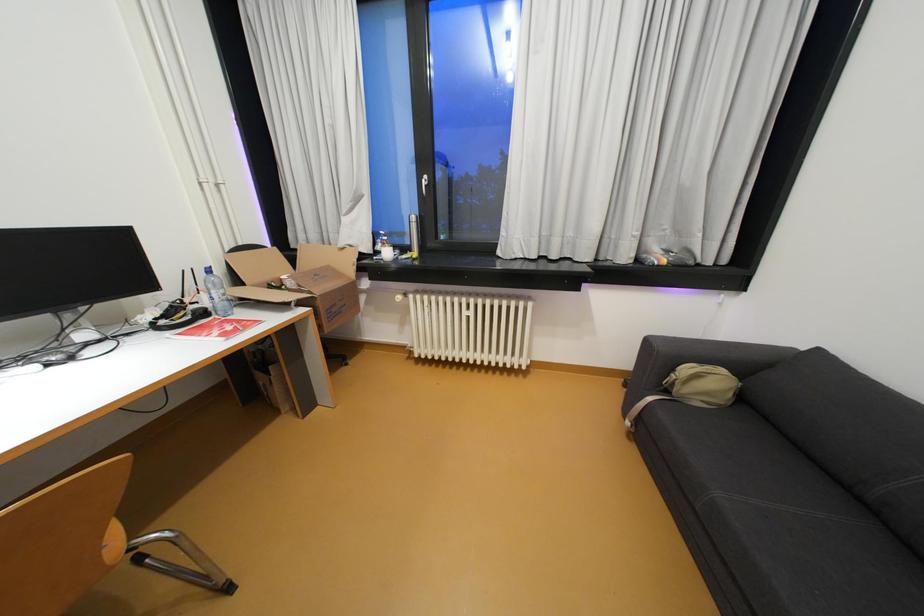
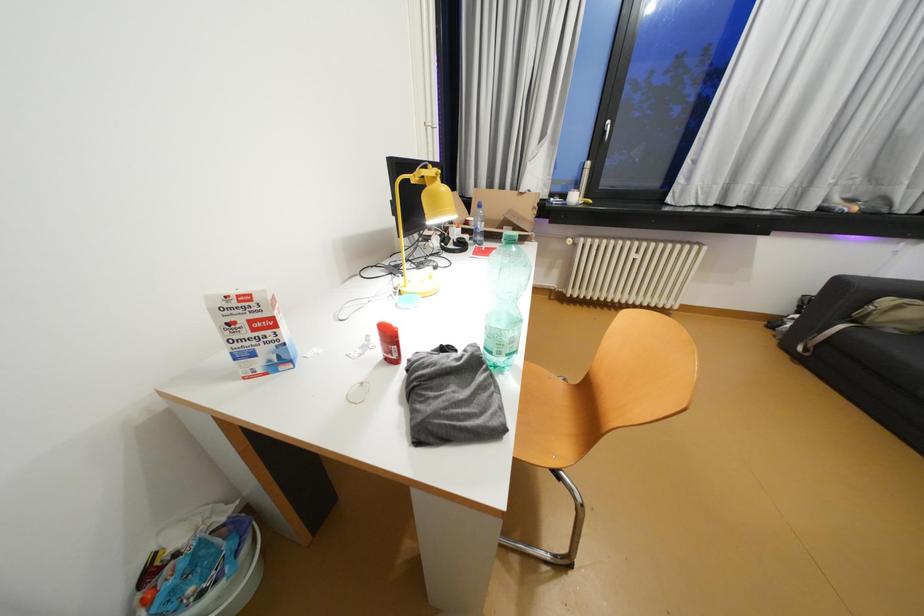
Question: In a continuous first-person perspective shot, in which direction is the camera moving?

Choices:
 (A) Left
 (B) Right
 (C) Forward
 (D) Backward

Answer: (A)